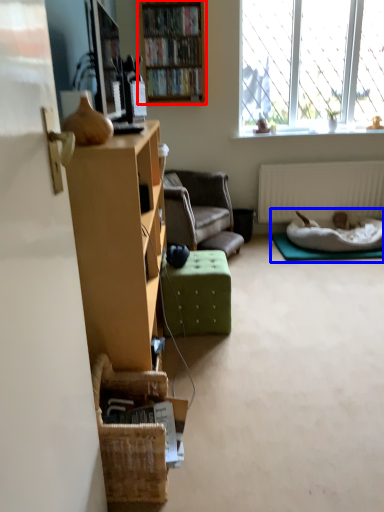
Question: Which object appears closest to the camera in this image, bookcase (highlighted by a red box) or bed (highlighted by a blue box)?

Choices:
 (A) bookcase
 (B) bed

Answer: (A)